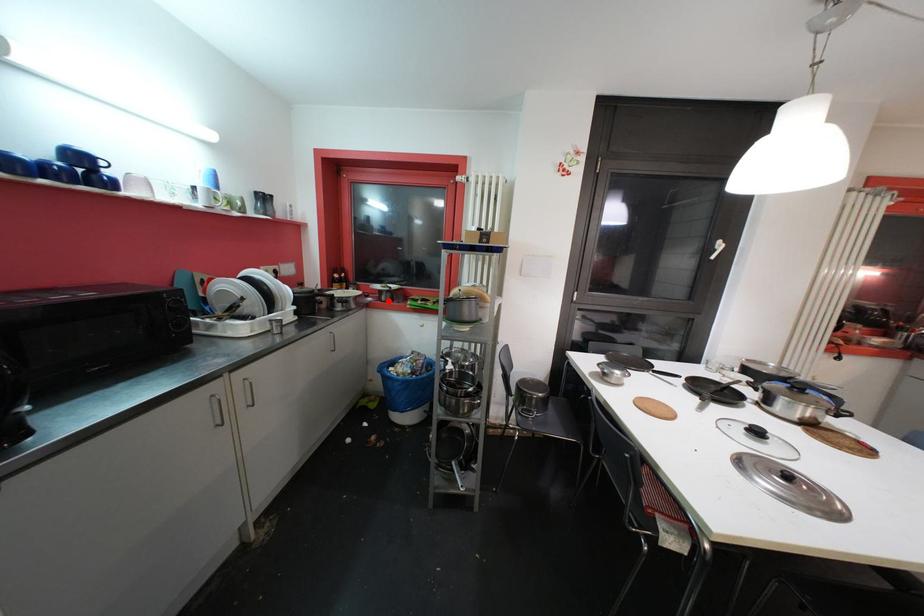
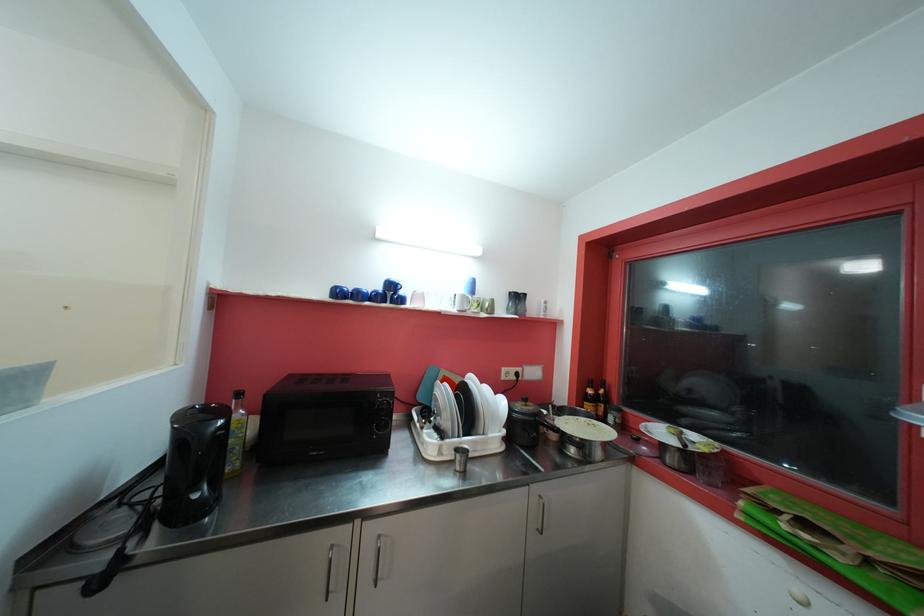
Where in the second image is the point corresponding to the highlighted location from the first image?

(675, 462)